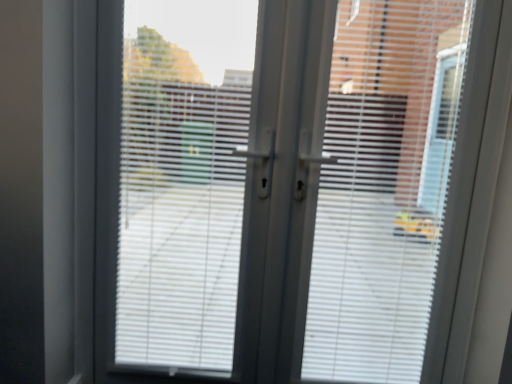
Question: Is white plastic window screen at center wider or thinner than white matte blinds at center?

Choices:
 (A) wide
 (B) thin

Answer: (B)

Question: In the image, is white plastic window screen at center on the left side or the right side of white matte blinds at center?

Choices:
 (A) right
 (B) left

Answer: (B)

Question: From the image's perspective, is white plastic window screen at center positioned above or below white matte blinds at center?

Choices:
 (A) below
 (B) above

Answer: (B)

Question: Considering the relative positions of white matte blinds at center and white plastic window screen at center in the image provided, is white matte blinds at center to the left or to the right of white plastic window screen at center?

Choices:
 (A) right
 (B) left

Answer: (A)

Question: Does point (376, 256) appear closer or farther from the camera than point (138, 71)?

Choices:
 (A) closer
 (B) farther

Answer: (B)

Question: Based on their sizes in the image, would you say white matte blinds at center is bigger or smaller than white plastic window screen at center?

Choices:
 (A) big
 (B) small

Answer: (A)

Question: From their relative heights in the image, would you say white matte blinds at center is taller or shorter than white plastic window screen at center?

Choices:
 (A) short
 (B) tall

Answer: (B)